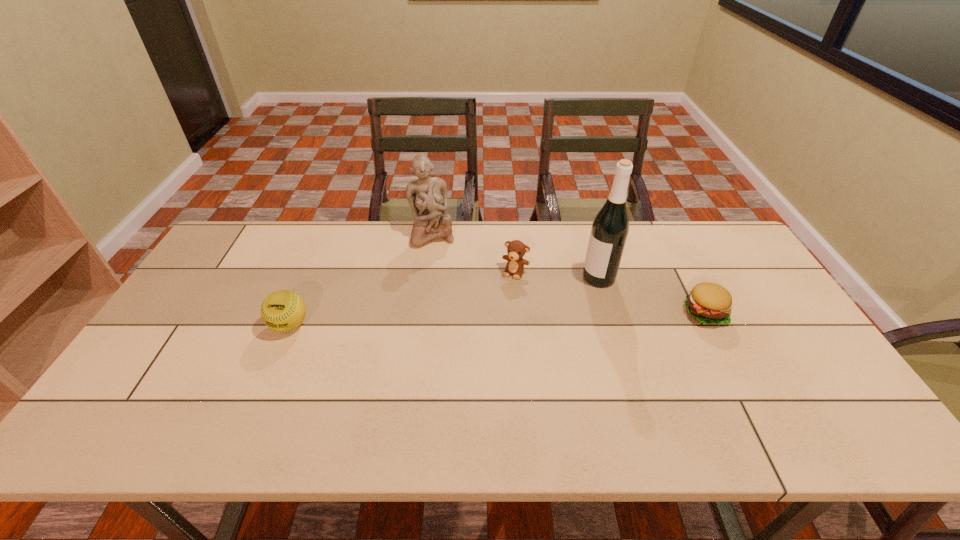
The image size is (960, 540). Find the location of `figurine that is at the far edge`. figurine that is at the far edge is located at coordinates (427, 196).

The width and height of the screenshot is (960, 540). What are the coordinates of `free space at the far edge of the desktop` in the screenshot? It's located at (364, 253).

Locate an element on the screen. This screenshot has height=540, width=960. free space at the near edge of the desktop is located at coordinates (320, 389).

In the image, there is a desktop. Identify the location of vacant area at the left edge. Image resolution: width=960 pixels, height=540 pixels. (188, 313).

Locate an element on the screen. This screenshot has width=960, height=540. vacant space at the right edge is located at coordinates (775, 322).

The width and height of the screenshot is (960, 540). I want to click on vacant area between the tallest object and the teddy bear, so click(x=557, y=275).

Locate an element on the screen. blank region between the second object from right to left and the teddy bear is located at coordinates (557, 275).

You are a GUI agent. You are given a task and a screenshot of the screen. Output one action in this format:
    pyautogui.click(x=<x>, y=<y>)
    Task: Click on the free space between the wine bottle and the softball
    The width and height of the screenshot is (960, 540).
    Given the screenshot: What is the action you would take?
    pyautogui.click(x=444, y=301)

Locate an element on the screen. This screenshot has width=960, height=540. blank region between the tallest object and the softball is located at coordinates (444, 301).

Where is `vacant area between the hamburger and the figurine`? The image size is (960, 540). vacant area between the hamburger and the figurine is located at coordinates (568, 274).